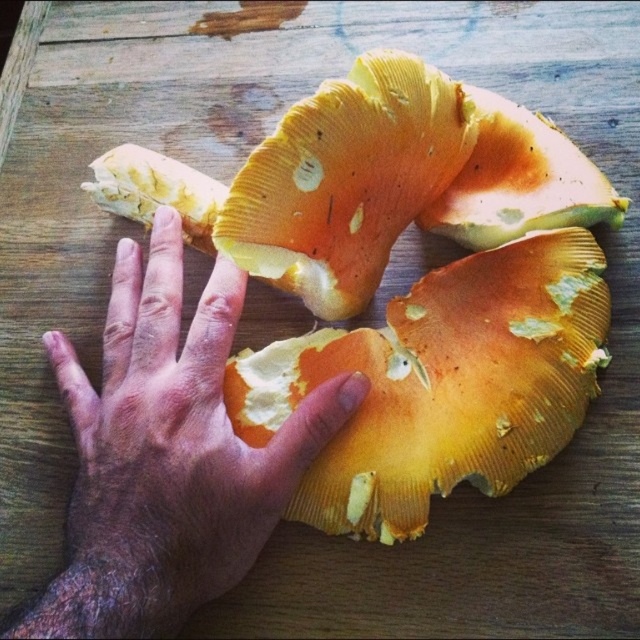
You are a chef preparing a dish and need to place the yellow soft mushroom at center and the dry skin at center onto a small plate. Which object should you place first to ensure both fit properly?

The yellow soft mushroom at center should be placed first since it is positioned over the dry skin at center, indicating it occupies the primary spot on the plate.

You are a chef preparing a dish and need to place a yellow soft mushroom at center on a plate. The plate is placed at point (410, 289). Can you confirm if the yellow soft mushroom at center is already located at the correct position?

The yellow soft mushroom at center is represented by point (410, 289), so yes, it is already at the correct position on the plate.